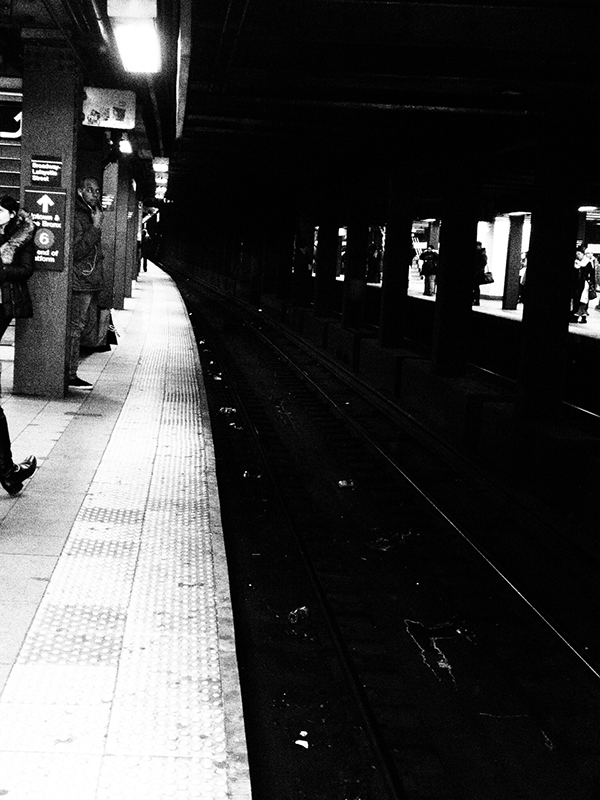
Image resolution: width=600 pixels, height=800 pixels. What are the coordinates of `light` in the screenshot? It's located at (134, 30).